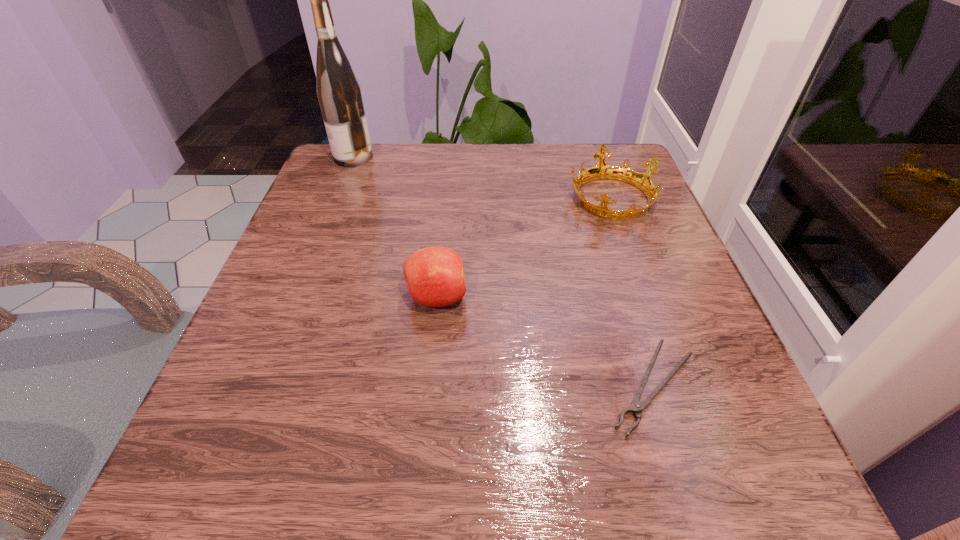
Locate an element on the screen. The width and height of the screenshot is (960, 540). vacant region between the leftmost object and the crown is located at coordinates click(x=482, y=177).

Identify the location of free space that is in between the crown and the wine bottle. (482, 177).

Locate an element on the screen. vacant area between the wine bottle and the second nearest object is located at coordinates (395, 227).

I want to click on free spot between the crown and the apple, so click(x=523, y=247).

The width and height of the screenshot is (960, 540). In order to click on free space between the second tallest object and the nearest object in this screenshot , I will do `click(544, 342)`.

The height and width of the screenshot is (540, 960). I want to click on empty space that is in between the tallest object and the nearest object, so click(503, 272).

In order to click on free space that is in between the leftmost object and the crown in this screenshot , I will do `click(482, 177)`.

Locate an element on the screen. The height and width of the screenshot is (540, 960). object that stands as the second closest to the farthest object is located at coordinates (642, 181).

You are a GUI agent. You are given a task and a screenshot of the screen. Output one action in this format:
    pyautogui.click(x=<x>, y=<y>)
    Task: Click on the second closest object relative to the second object from left to right
    This screenshot has width=960, height=540.
    Given the screenshot: What is the action you would take?
    pyautogui.click(x=642, y=181)

You are a GUI agent. You are given a task and a screenshot of the screen. Output one action in this format:
    pyautogui.click(x=<x>, y=<y>)
    Task: Click on the vacant space that satisfies the following two spatial constraints: 1. on the front side of the third shortest object; 2. on the right side of the nearest object
    This screenshot has height=540, width=960.
    Given the screenshot: What is the action you would take?
    pyautogui.click(x=428, y=386)